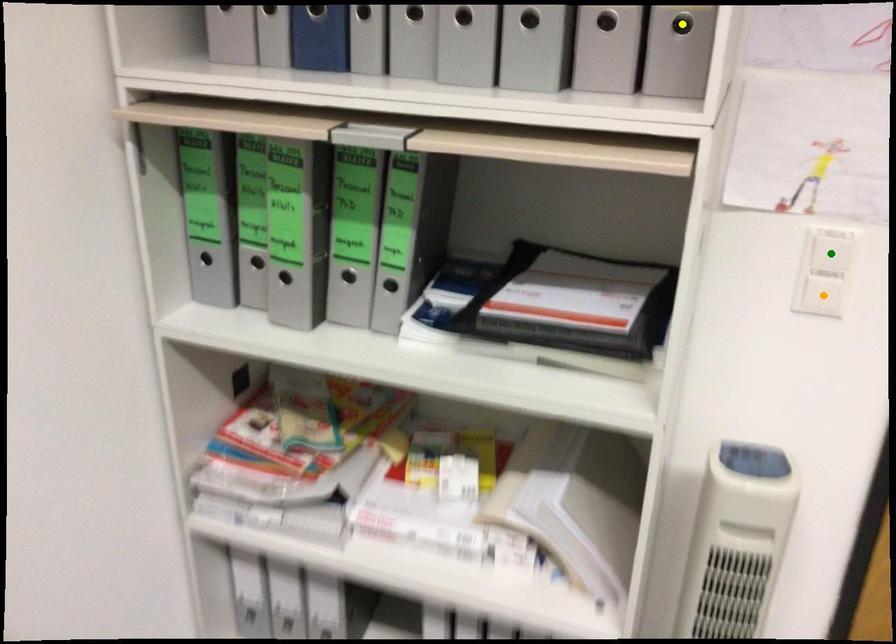
Consider the image. Order these from farthest to nearest:
- orange point
- green point
- yellow point

orange point, green point, yellow point